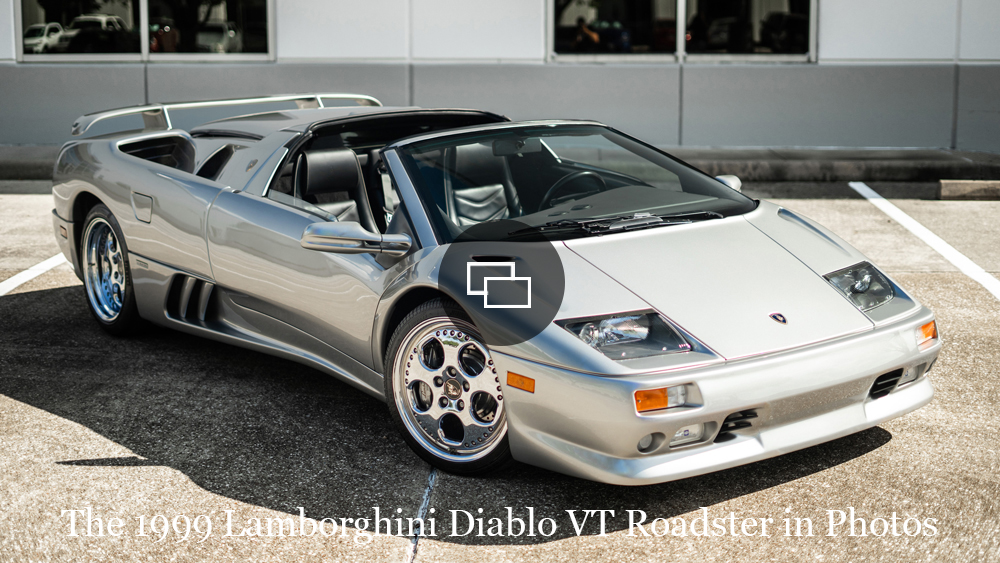
Where is `light`? The image size is (1000, 563). light is located at coordinates (657, 395).